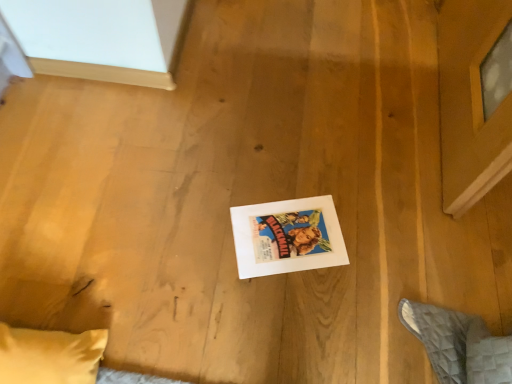
Question: Should I look upward or downward to see white paper at center?

Choices:
 (A) up
 (B) down

Answer: (B)